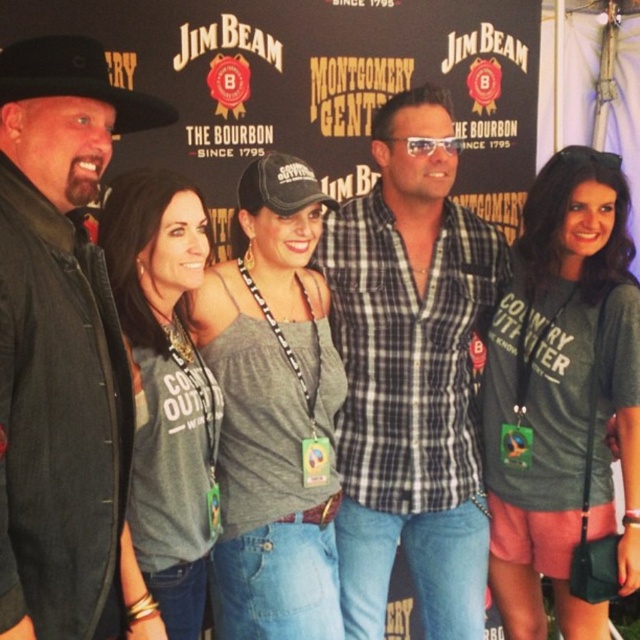
Who is positioned more to the left, gray fabric shirt at center or clear plastic sunglasses at center?

Result: gray fabric shirt at center is more to the left.

Does point (140, 547) come in front of point (432, 150)?

Yes, it is in front of point (432, 150).

I want to click on gray fabric shirt at center, so pos(164,387).

Can you confirm if black leather jacket at left is positioned above black felt cowboy hat at upper left?

Actually, black leather jacket at left is below black felt cowboy hat at upper left.

Which is below, black leather jacket at left or black felt cowboy hat at upper left?

Positioned lower is black leather jacket at left.

The width and height of the screenshot is (640, 640). What are the coordinates of `black leather jacket at left` in the screenshot? It's located at (61, 353).

From the picture: Is gray cotton tank top at center below gray fabric shirt at center?

Correct, gray cotton tank top at center is located below gray fabric shirt at center.

Can you confirm if gray cotton tank top at center is positioned to the right of gray fabric shirt at center?

Yes, gray cotton tank top at center is to the right of gray fabric shirt at center.

Is point (276, 536) closer to camera compared to point (134, 529)?

No, it is not.

Find the location of a particular element. gray cotton tank top at center is located at coordinates (273, 413).